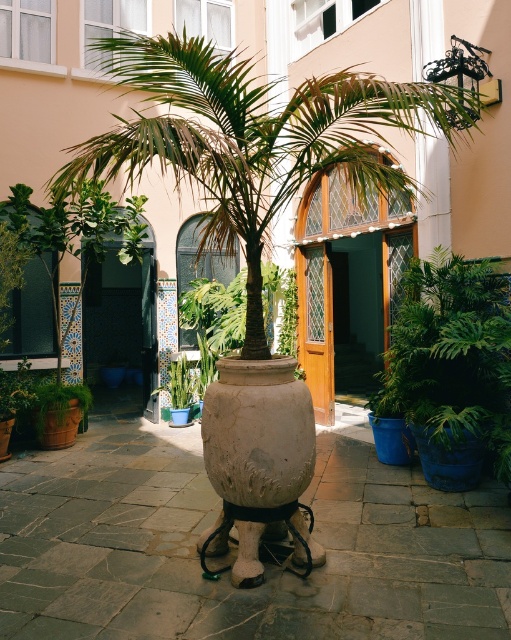
Where is `green leafy palm tree at center`? This screenshot has width=511, height=640. green leafy palm tree at center is located at coordinates (254, 140).

Is green leafy palm tree at center to the right of white textured vase at center from the viewer's perspective?

Correct, you'll find green leafy palm tree at center to the right of white textured vase at center.

Who is more forward, (126, 33) or (220, 481)?

Point (220, 481) is in front.

Locate an element on the screen. The image size is (511, 640). green leafy palm tree at center is located at coordinates (254, 140).